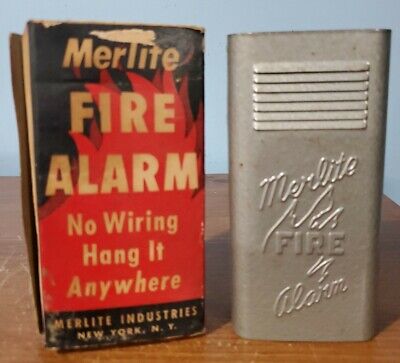
Find the location of a particular element. Image resolution: width=400 pixels, height=363 pixels. alarm is located at coordinates (313, 295).